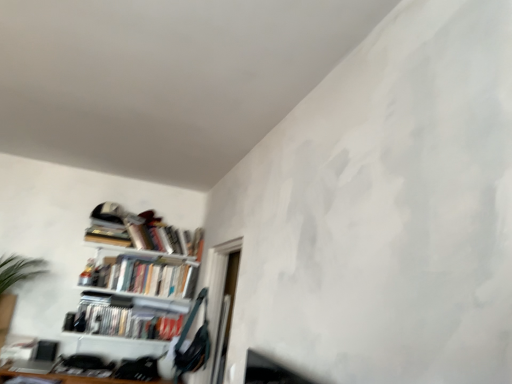
Describe the element at coordinates (147, 236) in the screenshot. I see `hardcover books at upper left, which appears as the first book when viewed from the top` at that location.

How much space does white glossy bookshelf at lower left, which is counted as the first book, starting from the bottom, occupy vertically?

It is 7.83 inches.

The height and width of the screenshot is (384, 512). What do you see at coordinates (148, 275) in the screenshot?
I see `hardcover books at upper left, the second book when ordered from top to bottom` at bounding box center [148, 275].

At what (x,y) coordinates should I click in order to perform the action: click on hardcover books at upper left, which appears as the first book when viewed from the top. Please return your answer as a coordinate pair (x, y). Looking at the image, I should click on (147, 236).

Considering the positions of objects hardcover books at upper left, which is the 3th book in bottom-to-top order, and hardcover books at upper left, which is counted as the second book, starting from the bottom, in the image provided, who is behind, hardcover books at upper left, which is the 3th book in bottom-to-top order, or hardcover books at upper left, which is counted as the second book, starting from the bottom,?

hardcover books at upper left, which is the 3th book in bottom-to-top order.

Consider the image. Which object is positioned more to the left, hardcover books at upper left, which appears as the first book when viewed from the top, or hardcover books at upper left, the second book when ordered from top to bottom?

Positioned to the left is hardcover books at upper left, the second book when ordered from top to bottom.

From a real-world perspective, who is located higher, hardcover books at upper left, which appears as the first book when viewed from the top, or hardcover books at upper left, the second book when ordered from top to bottom?

In real-world perspective, hardcover books at upper left, which appears as the first book when viewed from the top, is above.

Where is `book located behind the hardcover books at upper left, which is counted as the second book, starting from the bottom`? This screenshot has width=512, height=384. book located behind the hardcover books at upper left, which is counted as the second book, starting from the bottom is located at coordinates (147, 236).

Between white glossy bookshelf at lower left, which is counted as the first book, starting from the bottom, and hardcover books at upper left, which is the 3th book in bottom-to-top order, which one has less height?

white glossy bookshelf at lower left, which is counted as the first book, starting from the bottom.

Could hardcover books at upper left, which appears as the first book when viewed from the top, be considered to be inside white glossy bookshelf at lower left, which is counted as the first book, starting from the bottom?

No, white glossy bookshelf at lower left, which is counted as the first book, starting from the bottom, does not contain hardcover books at upper left, which appears as the first book when viewed from the top.

Is white glossy bookshelf at lower left, which is the 3th book in top-to-bottom order, positioned in front of hardcover books at upper left, which is the 3th book in bottom-to-top order?

Yes, white glossy bookshelf at lower left, which is the 3th book in top-to-bottom order, is in front of hardcover books at upper left, which is the 3th book in bottom-to-top order.

Are white glossy bookshelf at lower left, which is the 3th book in top-to-bottom order, and hardcover books at upper left, which appears as the first book when viewed from the top, located far from each other?

No, white glossy bookshelf at lower left, which is the 3th book in top-to-bottom order, is not far away from hardcover books at upper left, which appears as the first book when viewed from the top.

Is white glossy bookshelf at lower left, which is counted as the first book, starting from the bottom, closer to the viewer compared to hardcover books at upper left, the second book when ordered from top to bottom?

That is True.

Is white glossy bookshelf at lower left, which is counted as the first book, starting from the bottom, beside hardcover books at upper left, the second book when ordered from top to bottom?

No, white glossy bookshelf at lower left, which is counted as the first book, starting from the bottom, is not beside hardcover books at upper left, the second book when ordered from top to bottom.

Between white glossy bookshelf at lower left, which is counted as the first book, starting from the bottom, and hardcover books at upper left, the second book when ordered from top to bottom, which one appears on the left side from the viewer's perspective?

Answer: Positioned to the left is white glossy bookshelf at lower left, which is counted as the first book, starting from the bottom.

From a real-world perspective, is white glossy bookshelf at lower left, which is counted as the first book, starting from the bottom, physically below hardcover books at upper left, which is counted as the second book, starting from the bottom?

Indeed, from a real-world perspective, white glossy bookshelf at lower left, which is counted as the first book, starting from the bottom, is positioned beneath hardcover books at upper left, which is counted as the second book, starting from the bottom.

Consider the image. Which point is more forward, (239, 249) or (82, 319)?

The point (239, 249) is more forward.

Image resolution: width=512 pixels, height=384 pixels. In the image, there is a transparent glass door at center. What are the coordinates of `book below it (from the image's perspective)` in the screenshot? It's located at (126, 316).

Could white glossy bookshelf at lower left, which is counted as the first book, starting from the bottom, be considered to be inside transparent glass door at center?

No, white glossy bookshelf at lower left, which is counted as the first book, starting from the bottom, is not surrounded by transparent glass door at center.

Is point (187, 242) positioned in front of point (212, 270)?

That is False.

Is metallic silver bookshelf at left facing away from transparent glass door at center?

No, transparent glass door at center is not at the back of metallic silver bookshelf at left.

Considering the positions of objects metallic silver bookshelf at left and transparent glass door at center in the image provided, who is more to the right, metallic silver bookshelf at left or transparent glass door at center?

Positioned to the right is transparent glass door at center.

Considering the sizes of objects metallic silver bookshelf at left and transparent glass door at center in the image provided, who is thinner, metallic silver bookshelf at left or transparent glass door at center?

transparent glass door at center.

Considering their positions, is hardcover books at upper left, which is counted as the second book, starting from the bottom, located in front of or behind metallic silver bookshelf at left?

hardcover books at upper left, which is counted as the second book, starting from the bottom, is behind metallic silver bookshelf at left.

From a real-world perspective, is hardcover books at upper left, which is counted as the second book, starting from the bottom, located beneath metallic silver bookshelf at left?

Incorrect, from a real-world perspective, hardcover books at upper left, which is counted as the second book, starting from the bottom, is higher than metallic silver bookshelf at left.

From the image's perspective, which one is positioned lower, hardcover books at upper left, which is counted as the second book, starting from the bottom, or metallic silver bookshelf at left?

metallic silver bookshelf at left, from the image's perspective.

Can you tell me how much hardcover books at upper left, the second book when ordered from top to bottom, and metallic silver bookshelf at left differ in facing direction?

hardcover books at upper left, the second book when ordered from top to bottom, and metallic silver bookshelf at left are facing 4.95 degrees away from each other.

Does transparent glass door at center appear on the left side of hardcover books at upper left, which is the 3th book in bottom-to-top order?

Incorrect, transparent glass door at center is not on the left side of hardcover books at upper left, which is the 3th book in bottom-to-top order.

Does point (213, 381) appear closer or farther from the camera than point (192, 236)?

Point (213, 381).

The image size is (512, 384). In order to click on book above the hardcover books at upper left, which is counted as the second book, starting from the bottom (from a real-world perspective) in this screenshot , I will do [x=147, y=236].

Where is `book that is the 2nd object to the left of the hardcover books at upper left, which appears as the first book when viewed from the top, starting at the anchor`? This screenshot has width=512, height=384. book that is the 2nd object to the left of the hardcover books at upper left, which appears as the first book when viewed from the top, starting at the anchor is located at coordinates [126, 316].

When comparing their distances from transparent glass door at center, does white glossy bookshelf at lower left, which is counted as the first book, starting from the bottom, or hardcover books at upper left, the second book when ordered from top to bottom, seem further?

The object further to transparent glass door at center is white glossy bookshelf at lower left, which is counted as the first book, starting from the bottom.

In the scene shown: When comparing their distances from hardcover books at upper left, which appears as the first book when viewed from the top, does white glossy bookshelf at lower left, which is counted as the first book, starting from the bottom, or hardcover books at upper left, which is counted as the second book, starting from the bottom, seem further?

white glossy bookshelf at lower left, which is counted as the first book, starting from the bottom, is further to hardcover books at upper left, which appears as the first book when viewed from the top.

Considering their positions, is hardcover books at upper left, which is the 3th book in bottom-to-top order, positioned closer to metallic silver bookshelf at left than hardcover books at upper left, which is counted as the second book, starting from the bottom?

Based on the image, hardcover books at upper left, which is counted as the second book, starting from the bottom, appears to be nearer to metallic silver bookshelf at left.

Considering their positions, is transparent glass door at center positioned closer to metallic silver bookshelf at left than white glossy bookshelf at lower left, which is counted as the first book, starting from the bottom?

white glossy bookshelf at lower left, which is counted as the first book, starting from the bottom.

Estimate the real-world distances between objects in this image. Which object is closer to white glossy bookshelf at lower left, which is the 3th book in top-to-bottom order, transparent glass door at center or metallic silver bookshelf at left?

Based on the image, metallic silver bookshelf at left appears to be nearer to white glossy bookshelf at lower left, which is the 3th book in top-to-bottom order.

Estimate the real-world distances between objects in this image. Which object is further from metallic silver bookshelf at left, transparent glass door at center or hardcover books at upper left, which is the 3th book in bottom-to-top order?

transparent glass door at center.

Estimate the real-world distances between objects in this image. Which object is closer to metallic silver bookshelf at left, hardcover books at upper left, which appears as the first book when viewed from the top, or white glossy bookshelf at lower left, which is the 3th book in top-to-bottom order?

white glossy bookshelf at lower left, which is the 3th book in top-to-bottom order, is closer to metallic silver bookshelf at left.

Looking at the image, which one is located further to hardcover books at upper left, the second book when ordered from top to bottom, hardcover books at upper left, which is the 3th book in bottom-to-top order, or transparent glass door at center?

transparent glass door at center lies further to hardcover books at upper left, the second book when ordered from top to bottom, than the other object.

The width and height of the screenshot is (512, 384). I want to click on shelf that lies between hardcover books at upper left, the second book when ordered from top to bottom, and white glossy bookshelf at lower left, which is the 3th book in top-to-bottom order, from top to bottom, so click(136, 276).

Identify the location of book that lies between hardcover books at upper left, which is the 3th book in bottom-to-top order, and white glossy bookshelf at lower left, which is the 3th book in top-to-bottom order, from top to bottom. This screenshot has width=512, height=384. (148, 275).

The image size is (512, 384). I want to click on shelf between transparent glass door at center and white glossy bookshelf at lower left, which is the 3th book in top-to-bottom order, from front to back, so click(136, 276).

Where is `shelf between transparent glass door at center and hardcover books at upper left, which appears as the first book when viewed from the top, along the z-axis`? The image size is (512, 384). shelf between transparent glass door at center and hardcover books at upper left, which appears as the first book when viewed from the top, along the z-axis is located at coordinates (136, 276).